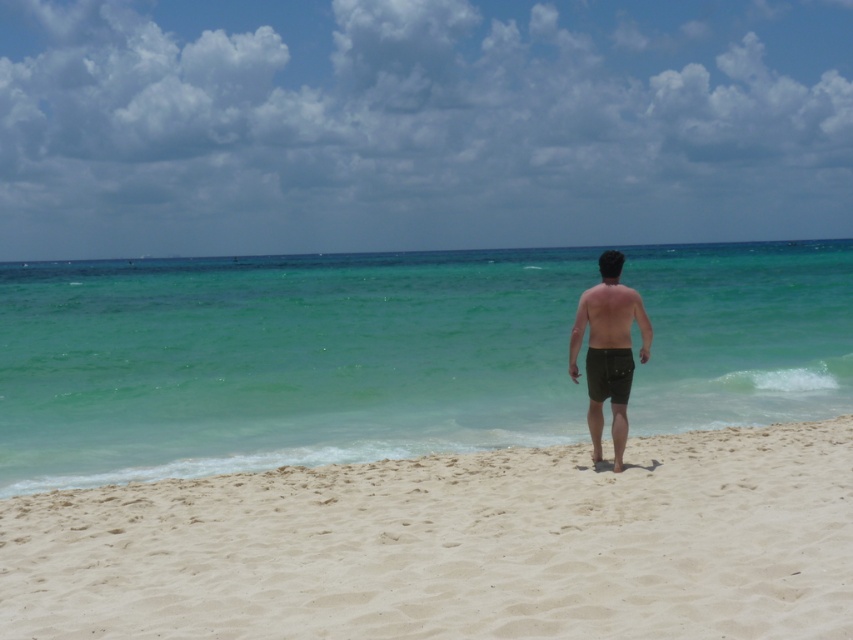
You are standing on the beach looking at the ocean. There is a point marked at coordinates (605, 314). What object is located at that point?

The point at coordinates (605, 314) corresponds to the brown matte shorts at center.

You are a photographer planning to capture a sunset at the beach. You want to position your tripod on the white sandy beach at center to ensure it is centered in the frame. Given the coordinates provided, where should you place the tripod to achieve this?

To center the tripod on the white sandy beach at center, place it at the coordinates provided, which are at point (456, 545).